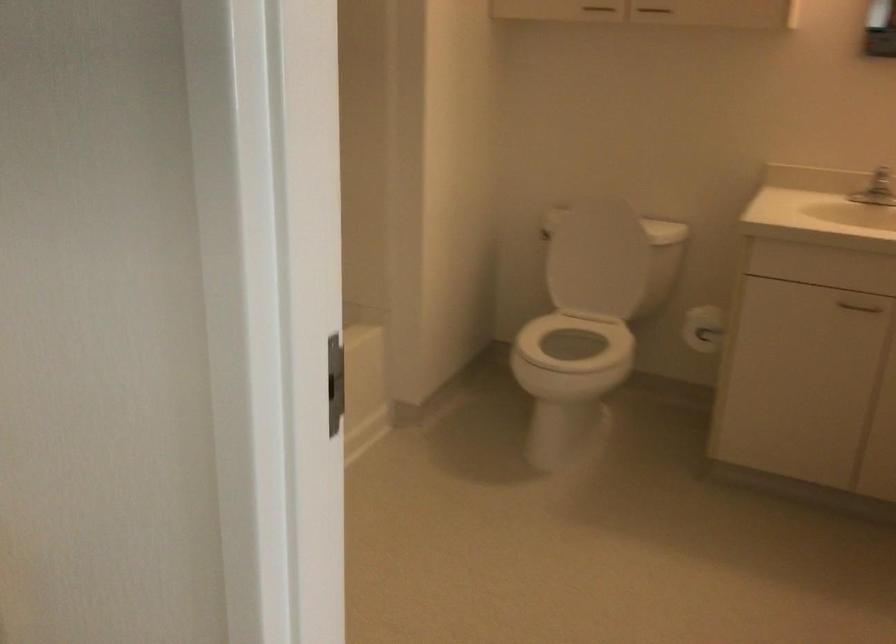
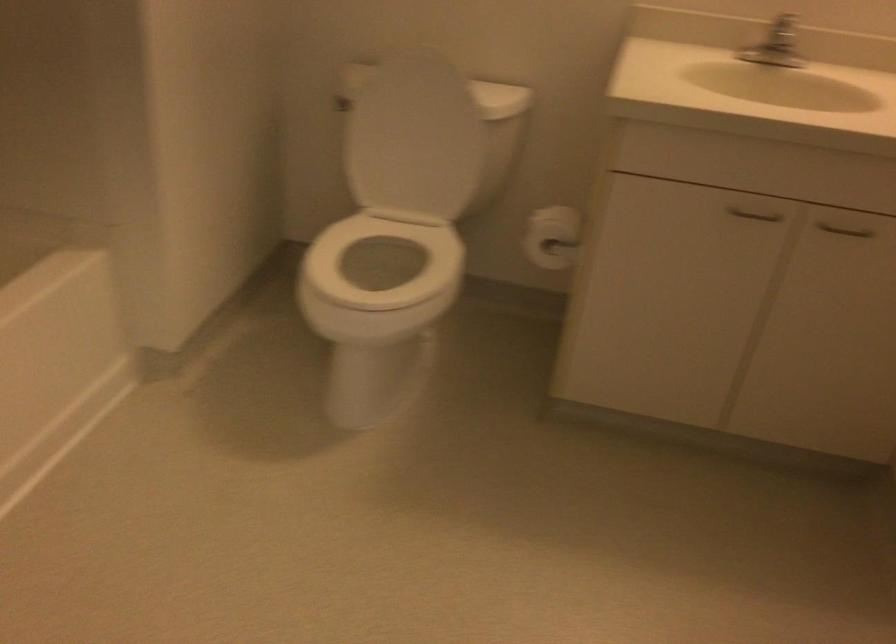
The point at (695, 328) is marked in the first image. Where is the corresponding point in the second image?

(552, 237)